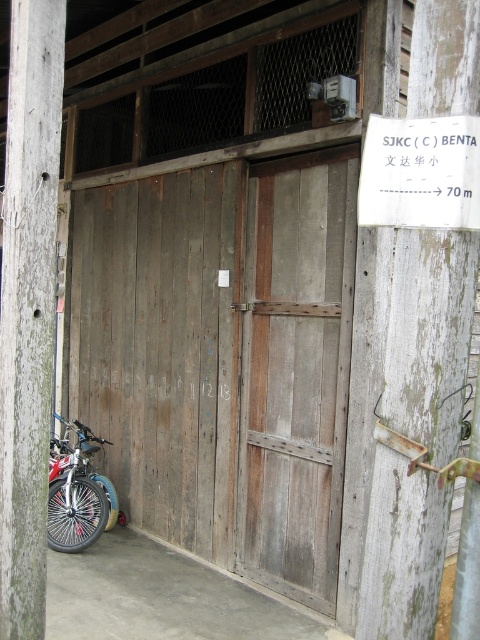
You are a delivery person trying to find the correct entrance to a warehouse. You see a weathered wood sign at right and a weathered wood post at left. Which object is closer to you as you approach the entrance?

The weathered wood sign at right is closer to you because it is in front of the weathered wood post at left.